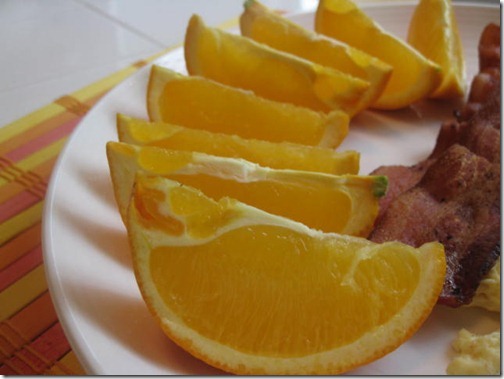
Where is `white tabletop`? The width and height of the screenshot is (504, 379). white tabletop is located at coordinates (45, 67).